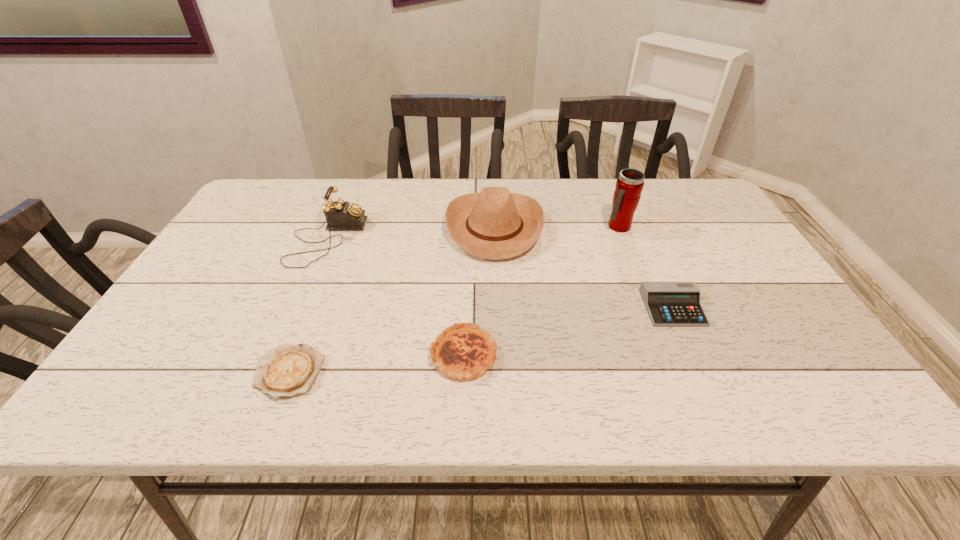
The height and width of the screenshot is (540, 960). Identify the location of the tallest object. (629, 185).

You are a GUI agent. You are given a task and a screenshot of the screen. Output one action in this format:
    pyautogui.click(x=<x>, y=<y>)
    Task: Click on the cowboy hat
    
    Given the screenshot: What is the action you would take?
    pyautogui.click(x=495, y=224)

Locate an element on the screen. telephone is located at coordinates pos(340,215).

What are the coordinates of `calculator` in the screenshot? It's located at click(x=669, y=304).

The image size is (960, 540). Identify the location of the right quiche. (463, 351).

Locate an element on the screen. The height and width of the screenshot is (540, 960). the shortest object is located at coordinates (288, 370).

You are a GUI agent. You are given a task and a screenshot of the screen. Output one action in this format:
    pyautogui.click(x=<x>, y=<y>)
    Task: Click on the shorter quiche
    The height and width of the screenshot is (540, 960).
    Given the screenshot: What is the action you would take?
    pyautogui.click(x=288, y=370)

The image size is (960, 540). What are the coordinates of `blank area located 0.370m on the side with the handle of the tallest object` in the screenshot? It's located at (661, 335).

I want to click on blank space located 0.290m on the front-facing side of the cowboy hat, so click(347, 227).

This screenshot has height=540, width=960. I want to click on free location located 0.170m on the front-facing side of the cowboy hat, so click(388, 227).